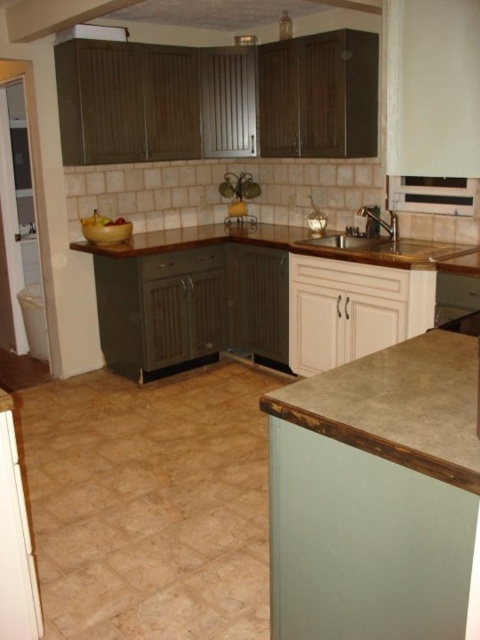
Question: Estimate the real-world distances between objects in this image. Which object is closer to the concrete textured countertop at lower right?

Choices:
 (A) brown laminate counter top at center
 (B) metallic sink at center

Answer: (B)

Question: Does concrete textured countertop at lower right appear on the left side of metallic sink at center?

Choices:
 (A) no
 (B) yes

Answer: (B)

Question: Among these objects, which one is farthest from the camera?

Choices:
 (A) concrete textured countertop at lower right
 (B) brown laminate counter top at center

Answer: (B)

Question: Which point appears farthest from the camera in this image?

Choices:
 (A) (137, 234)
 (B) (348, 396)
 (C) (406, 244)

Answer: (A)

Question: Where is brown laminate counter top at center located in relation to metallic sink at center in the image?

Choices:
 (A) right
 (B) left

Answer: (B)

Question: Does concrete textured countertop at lower right appear on the right side of brown laminate counter top at center?

Choices:
 (A) yes
 (B) no

Answer: (A)